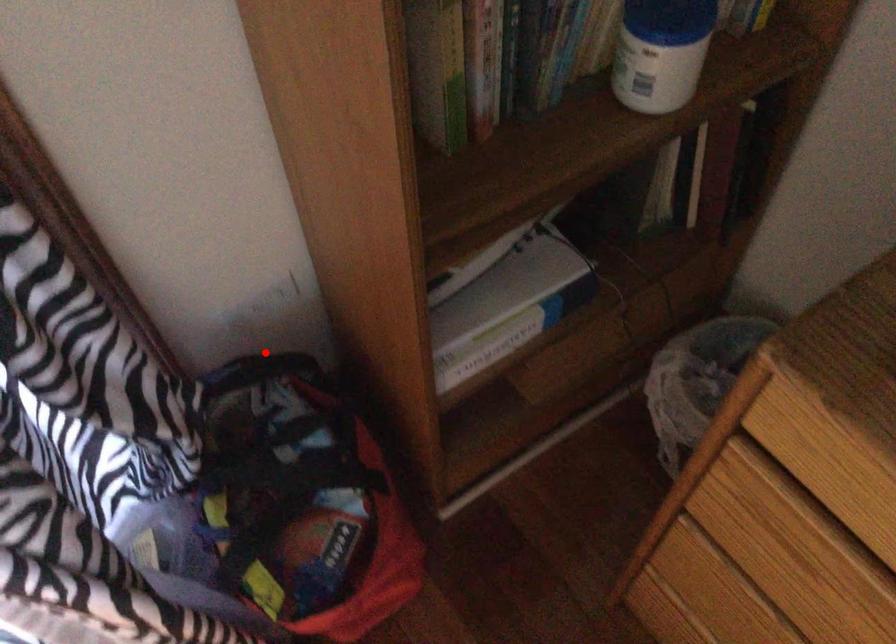
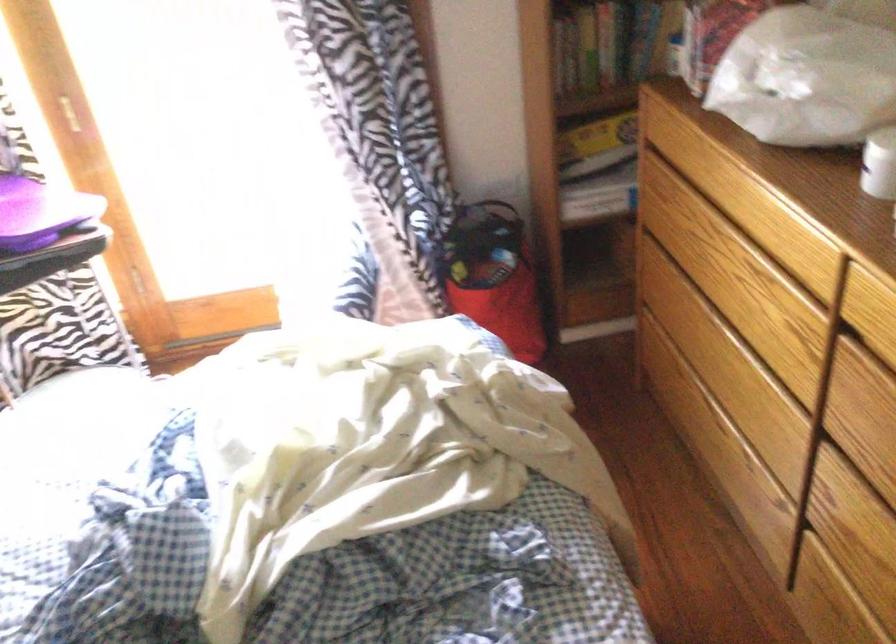
Question: I am providing you with two images of the same scene from different viewpoints. Image1 has a red point marked. In image2, the corresponding 3D location appears at what relative position? Reply with the corresponding letter.

Choices:
 (A) Closer
 (B) Farther

Answer: (B)